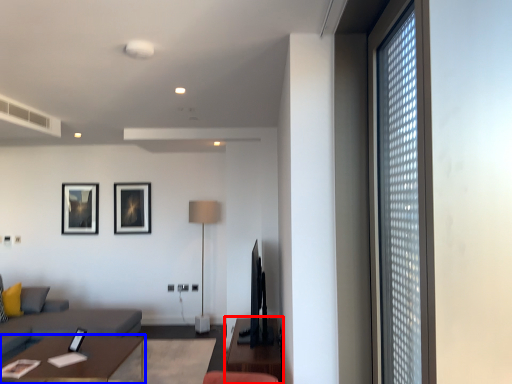
Question: Which of the following is the closest to the observer, table (highlighted by a red box) or table (highlighted by a blue box)?

Choices:
 (A) table
 (B) table

Answer: (B)